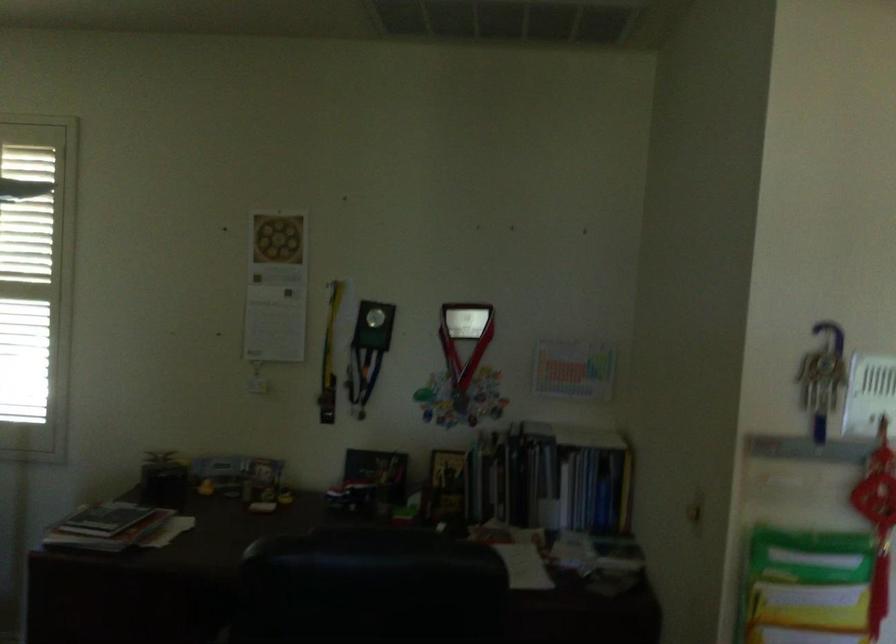
Where is `stack of magazines`? Image resolution: width=896 pixels, height=644 pixels. stack of magazines is located at coordinates (497, 486).